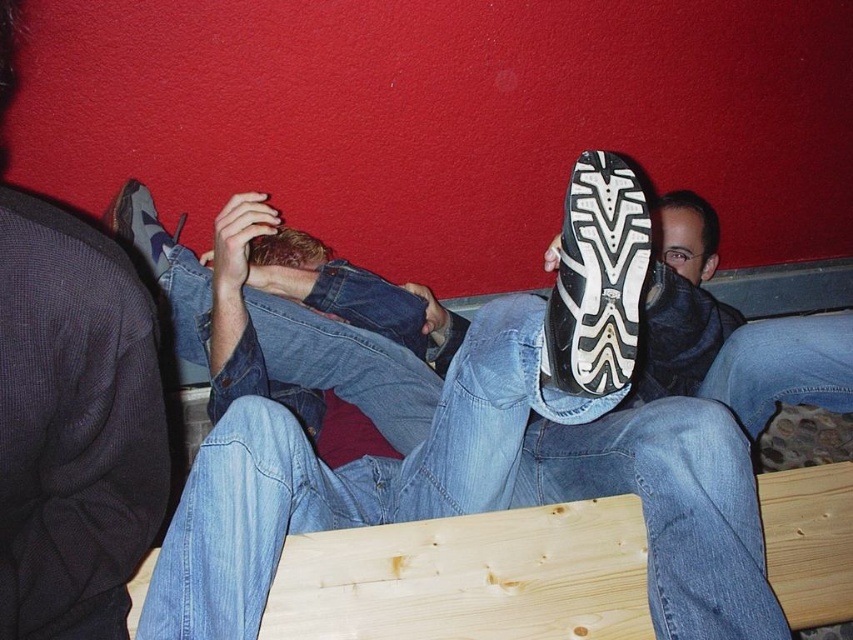
Question: Does matte black shoe at upper center have a lesser width compared to black rubber shoe at center?

Choices:
 (A) yes
 (B) no

Answer: (B)

Question: Does matte black shoe at upper center appear on the right side of black rubber shoe at center?

Choices:
 (A) yes
 (B) no

Answer: (B)

Question: Which object appears closest to the camera in this image?

Choices:
 (A) black rubber shoe at center
 (B) matte black shoe at upper center

Answer: (A)

Question: Which object is closer to the camera taking this photo?

Choices:
 (A) black rubber shoe at center
 (B) matte black shoe at upper center

Answer: (A)

Question: Does matte black shoe at upper center appear over black rubber shoe at center?

Choices:
 (A) yes
 (B) no

Answer: (B)